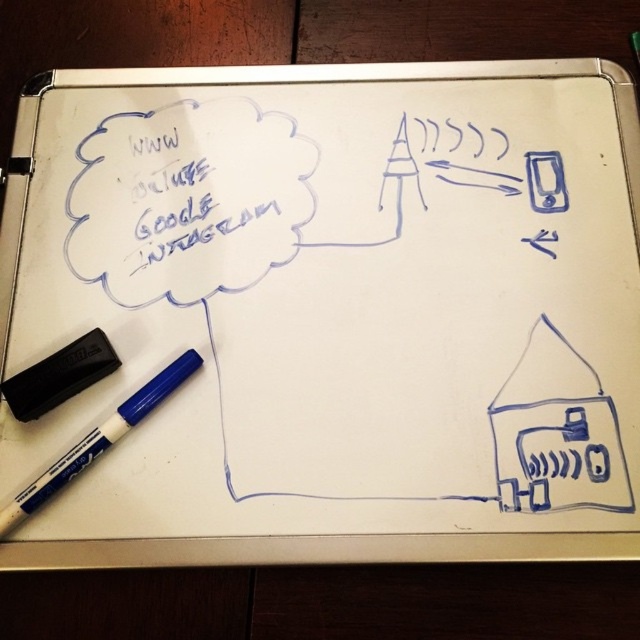
Question: Does blue handwritten text at upper left appear on the right side of white matte marker at bottom left?

Choices:
 (A) no
 (B) yes

Answer: (B)

Question: Which point is closer to the camera taking this photo?

Choices:
 (A) (118, 413)
 (B) (221, 147)

Answer: (A)

Question: Can you confirm if blue handwritten text at upper left is positioned below white matte marker at bottom left?

Choices:
 (A) yes
 (B) no

Answer: (B)

Question: Is blue handwritten text at upper left wider than white matte marker at bottom left?

Choices:
 (A) yes
 (B) no

Answer: (A)

Question: Which point is closer to the camera?

Choices:
 (A) blue handwritten text at upper left
 (B) white matte marker at bottom left

Answer: (B)